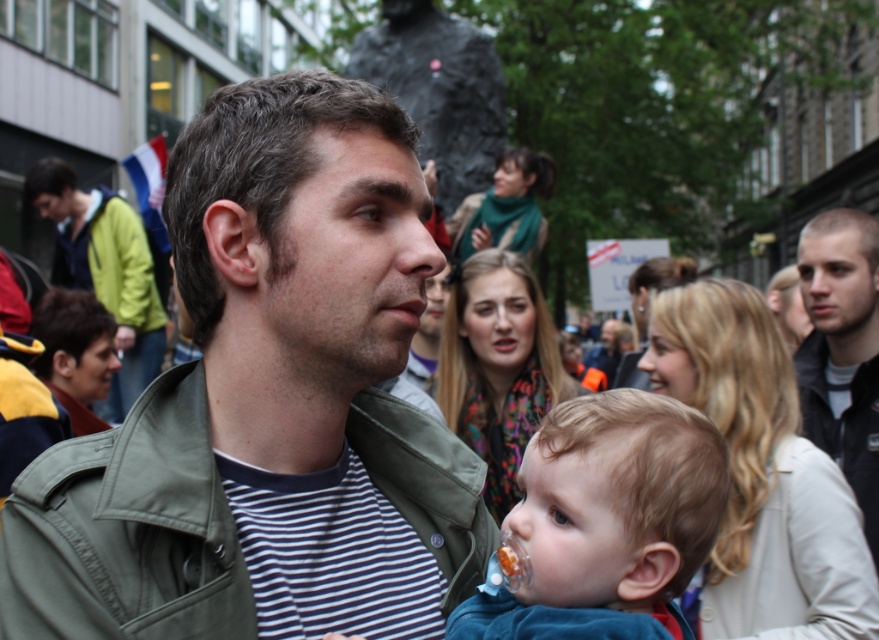
Does green matte jacket at center appear over smooth blue shirt at center?

Yes, green matte jacket at center is above smooth blue shirt at center.

Which is more to the right, green matte jacket at center or smooth blue shirt at center?

smooth blue shirt at center

Is point (233, 429) closer to viewer compared to point (659, 419)?

No, it is not.

This screenshot has height=640, width=879. Find the location of `green matte jacket at center`. green matte jacket at center is located at coordinates (267, 404).

Is green canvas jacket at center behind green fabric jacket at left?

That is False.

Can you confirm if green canvas jacket at center is positioned to the left of green fabric jacket at left?

In fact, green canvas jacket at center is to the right of green fabric jacket at left.

The width and height of the screenshot is (879, 640). Identify the location of green canvas jacket at center. (127, 531).

Does smooth blue shirt at center appear on the left side of green fabric jacket at left?

Incorrect, smooth blue shirt at center is not on the left side of green fabric jacket at left.

Is smooth blue shirt at center above green fabric jacket at left?

No, smooth blue shirt at center is not above green fabric jacket at left.

Does point (597, 486) lie in front of point (84, 230)?

Yes, it is.

Where is `smooth blue shirt at center`? The height and width of the screenshot is (640, 879). smooth blue shirt at center is located at coordinates (607, 520).